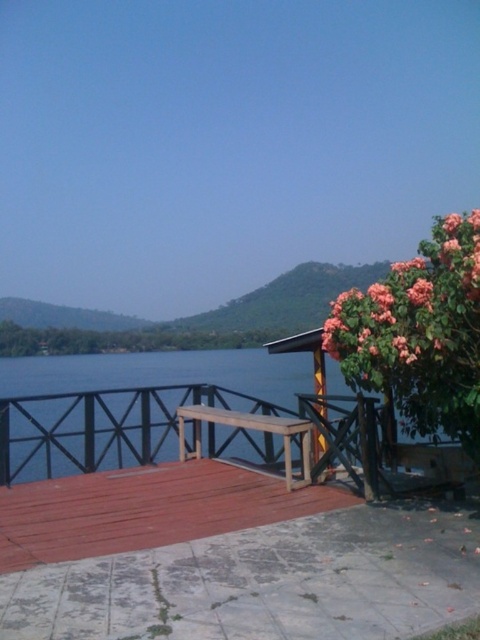
You are planning to take a photo of the pink matte flower at upper right and the wooden picnic table at center. Which object should you focus on first if you want to capture both in the same frame without moving the camera?

The pink matte flower at upper right should be focused on first since it is taller than the wooden picnic table at center, ensuring its full height is captured in the frame.

You are planning to take a photo of the wooden picnic table at center from the deck. The pink matte flower at upper right is blocking your view. Can you move the flower to the side to get a clear shot?

The pink matte flower at upper right is above the wooden picnic table at center, so you cannot move the flower as it is part of the scene and its position is fixed.